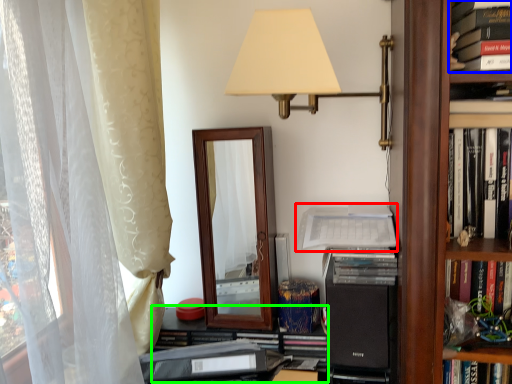
Question: Which is nearer to the paperback book (highlighted by a red box)? book (highlighted by a blue box) or shelf (highlighted by a green box).

Choices:
 (A) book
 (B) shelf

Answer: (B)